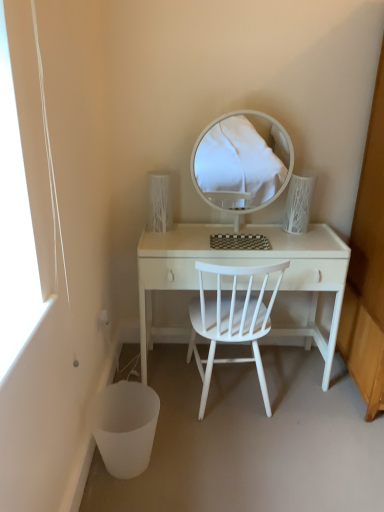
The image size is (384, 512). What do you see at coordinates (231, 321) in the screenshot? I see `white matte chair at center` at bounding box center [231, 321].

Measure the distance between white wood desk at center and camera.

The depth of white wood desk at center is 1.80 meters.

Locate an element on the screen. This screenshot has height=512, width=384. white matte chair at center is located at coordinates (231, 321).

Which of these two, white wood desk at center or white glossy mirror at center, stands shorter?

With less height is white glossy mirror at center.

Can we say white wood desk at center lies outside white glossy mirror at center?

That's correct, white wood desk at center is outside of white glossy mirror at center.

How much distance is there between white wood desk at center and white glossy mirror at center?

white wood desk at center and white glossy mirror at center are 1.45 meters apart.

Between white wood desk at center and white glossy mirror at center, which one is positioned in front?

Positioned in front is white glossy mirror at center.

I want to click on chair lying below the white wood desk at center (from the image's perspective), so click(231, 321).

Between white wood desk at center and white matte chair at center, which one is positioned in front?

white matte chair at center is closer to the camera.

Which of these two, white wood desk at center or white matte chair at center, is bigger?

white wood desk at center is bigger.

Is white glossy mirror at center directly adjacent to white matte chair at center?

No, white glossy mirror at center is not with white matte chair at center.

From a real-world perspective, between white glossy mirror at center and white matte chair at center, who is vertically lower?

From a 3D spatial view, white matte chair at center is below.

Is white glossy mirror at center at the left side of white matte chair at center?

Incorrect, white glossy mirror at center is not on the left side of white matte chair at center.

In the scene shown: Is white glossy mirror at center positioned in front of white matte chair at center?

No, white glossy mirror at center is further to the viewer.

Identify the location of mirror behind the white matte chair at center. (241, 162).

Which is behind, point (199, 264) or point (217, 182)?

The point (217, 182) is more distant.

Who is smaller, white matte chair at center or white glossy mirror at center?

With smaller size is white glossy mirror at center.

Is white matte chair at center oriented away from white glossy mirror at center?

white matte chair at center is not turned away from white glossy mirror at center.

You are a GUI agent. You are given a task and a screenshot of the screen. Output one action in this format:
    pyautogui.click(x=<x>, y=<y>)
    Task: Click on the desk beneath the white glossy mirror at center (from a real-world perspective)
    
    Given the screenshot: What is the action you would take?
    pyautogui.click(x=247, y=262)

Is white glossy mirror at center at the right side of white wood desk at center?

Yes, white glossy mirror at center is to the right of white wood desk at center.

What's the angular difference between white glossy mirror at center and white wood desk at center's facing directions?

The angle between the facing direction of white glossy mirror at center and the facing direction of white wood desk at center is 1.46 degrees.

Measure the distance from white matte chair at center to white wood desk at center.

white matte chair at center is 8.61 inches away from white wood desk at center.

Is white matte chair at center bigger than white wood desk at center?

No.

In terms of height, does white matte chair at center look taller or shorter compared to white wood desk at center?

In the image, white matte chair at center appears to be taller than white wood desk at center.

Is white matte chair at center in front of or behind white wood desk at center in the image?

white matte chair at center is in front of white wood desk at center.

This screenshot has width=384, height=512. In the image, there is a white glossy mirror at center. In order to click on desk below it (from a real-world perspective) in this screenshot , I will do `click(247, 262)`.

This screenshot has width=384, height=512. I want to click on chair below the white wood desk at center (from the image's perspective), so click(231, 321).

Looking at the image, which one is located closer to white glossy mirror at center, white matte chair at center or white wood desk at center?

Based on the image, white wood desk at center appears to be nearer to white glossy mirror at center.

Based on their spatial positions, is white glossy mirror at center or white matte chair at center closer to white wood desk at center?

white matte chair at center lies closer to white wood desk at center than the other object.

Looking at the image, which one is located further to white wood desk at center, white matte chair at center or white glossy mirror at center?

white glossy mirror at center lies further to white wood desk at center than the other object.

Based on their spatial positions, is white glossy mirror at center or white wood desk at center closer to white matte chair at center?

Among the two, white wood desk at center is located nearer to white matte chair at center.

Based on their spatial positions, is white wood desk at center or white matte chair at center further from white glossy mirror at center?

Among the two, white matte chair at center is located further to white glossy mirror at center.

Looking at the image, which one is located further to white matte chair at center, white wood desk at center or white glossy mirror at center?

Based on the image, white glossy mirror at center appears to be further to white matte chair at center.

The image size is (384, 512). Find the location of `desk between white glossy mirror at center and white matte chair at center from top to bottom`. desk between white glossy mirror at center and white matte chair at center from top to bottom is located at coordinates (247, 262).